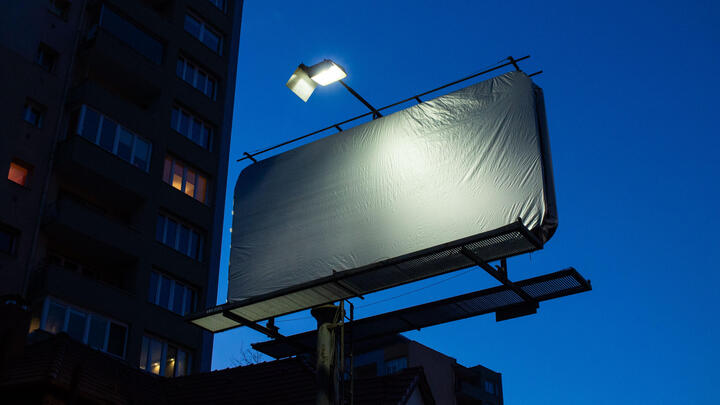
The image size is (720, 405). What are the coordinates of `grey cover` in the screenshot? It's located at tap(379, 211).